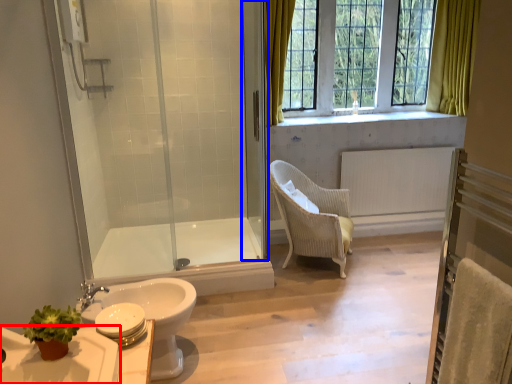
Question: Among these objects, which one is nearest to the camera, sink (highlighted by a red box) or screen door (highlighted by a blue box)?

Choices:
 (A) sink
 (B) screen door

Answer: (A)